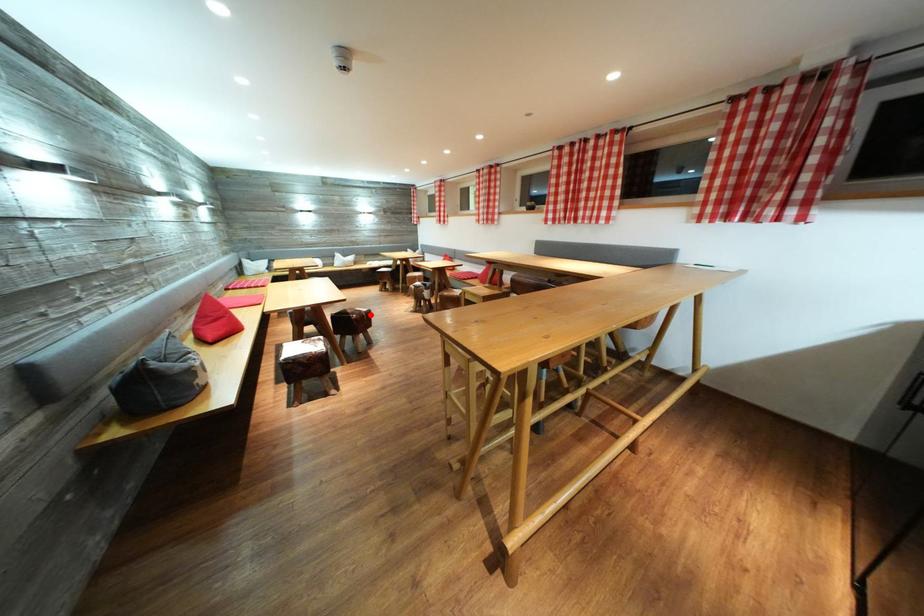
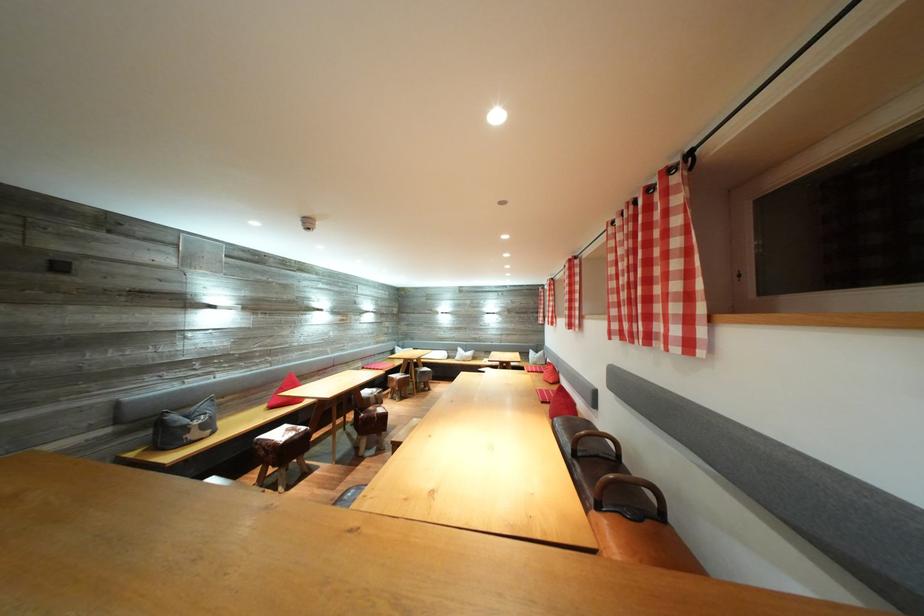
Where in the second image is the point corresponding to the highlighted location from the first image?

(386, 416)